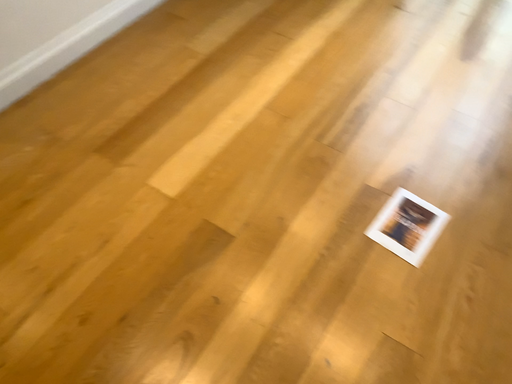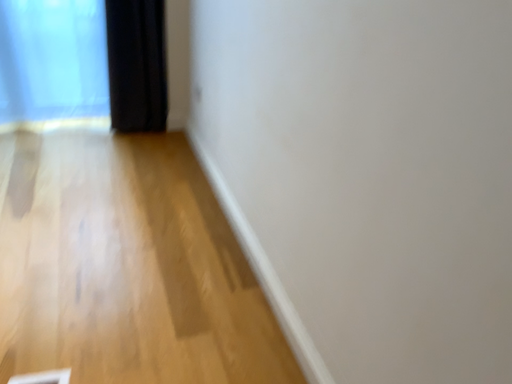
Question: Which way did the camera rotate in the video?

Choices:
 (A) rotated downward
 (B) rotated upward

Answer: (B)